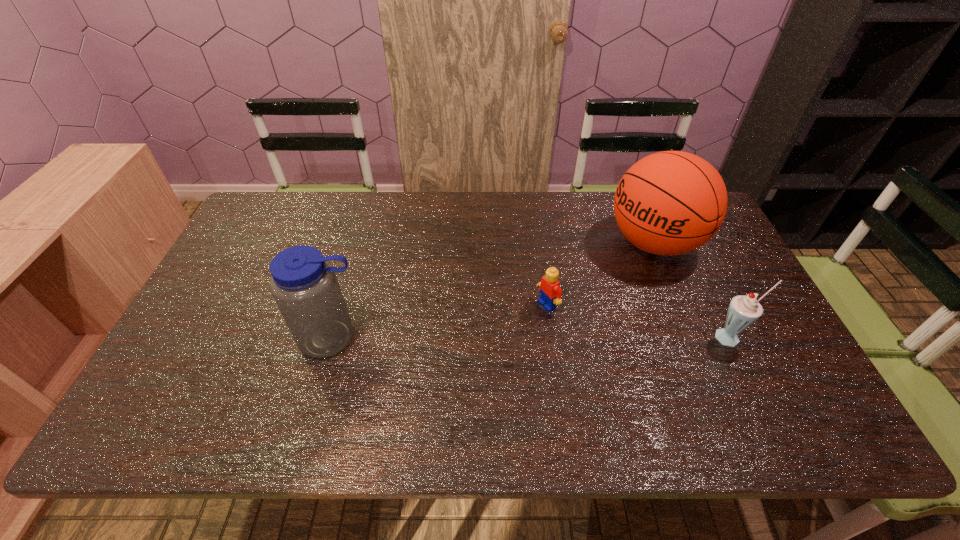
This screenshot has width=960, height=540. I want to click on the leftmost object, so pos(304,284).

The image size is (960, 540). In order to click on the second shortest object in this screenshot , I will do `click(744, 310)`.

Where is `the farthest object`? the farthest object is located at coordinates (668, 203).

Identify the location of the shortest object. The image size is (960, 540). (550, 292).

This screenshot has width=960, height=540. I want to click on Lego, so click(550, 292).

At what (x,y) coordinates should I click in order to perform the action: click on free space located 0.070m with a carrying loop on the side of the water bottle. Please return your answer as a coordinate pair (x, y). This screenshot has width=960, height=540. Looking at the image, I should click on (320, 387).

The height and width of the screenshot is (540, 960). I want to click on vacant area situated 0.130m on the straw side of the milkshake, so click(x=760, y=395).

In order to click on vacant area situated 0.400m on the side with logo of the farthest object in this screenshot , I will do `click(518, 325)`.

Where is `free spot located on the side with logo of the farthest object`? This screenshot has height=540, width=960. free spot located on the side with logo of the farthest object is located at coordinates (546, 308).

You are a GUI agent. You are given a task and a screenshot of the screen. Output one action in this format:
    pyautogui.click(x=<x>, y=<y>)
    Task: Click on the vacant space situated on the side with logo of the farthest object
    The height and width of the screenshot is (540, 960).
    Given the screenshot: What is the action you would take?
    pyautogui.click(x=533, y=316)